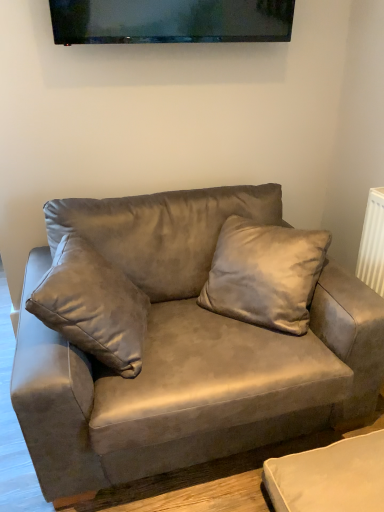
Question: Does matte black tv at upper center have a smaller size compared to suede gray couch at center?

Choices:
 (A) no
 (B) yes

Answer: (B)

Question: Does matte black tv at upper center have a larger size compared to suede gray couch at center?

Choices:
 (A) yes
 (B) no

Answer: (B)

Question: Considering the relative positions of matte black tv at upper center and suede gray couch at center in the image provided, is matte black tv at upper center in front of suede gray couch at center?

Choices:
 (A) yes
 (B) no

Answer: (B)

Question: Is suede gray couch at center a part of matte black tv at upper center?

Choices:
 (A) no
 (B) yes

Answer: (A)

Question: Is matte black tv at upper center placed right next to suede gray couch at center?

Choices:
 (A) yes
 (B) no

Answer: (B)

Question: Looking at their shapes, would you say suede gray couch at center is wider or thinner than suede pillow at center?

Choices:
 (A) wide
 (B) thin

Answer: (A)

Question: Is point (230, 338) closer or farther from the camera than point (205, 303)?

Choices:
 (A) farther
 (B) closer

Answer: (B)

Question: Based on their positions, is suede gray couch at center located to the left or right of suede pillow at center?

Choices:
 (A) left
 (B) right

Answer: (A)

Question: Choose the correct answer: Is suede gray couch at center inside suede pillow at center or outside it?

Choices:
 (A) outside
 (B) inside

Answer: (A)

Question: Is suede pillow at center bigger or smaller than suede gray couch at center?

Choices:
 (A) small
 (B) big

Answer: (A)

Question: Does point (238, 298) appear closer or farther from the camera than point (332, 420)?

Choices:
 (A) closer
 (B) farther

Answer: (A)

Question: Relative to suede gray couch at center, is suede pillow at center in front or behind?

Choices:
 (A) front
 (B) behind

Answer: (B)

Question: From a real-world perspective, is suede pillow at center physically located above or below suede gray couch at center?

Choices:
 (A) below
 (B) above

Answer: (B)

Question: From a real-world perspective, is matte black tv at upper center physically located above or below suede gray couch at center?

Choices:
 (A) below
 (B) above

Answer: (B)

Question: From the image's perspective, is matte black tv at upper center above or below suede gray couch at center?

Choices:
 (A) below
 (B) above

Answer: (B)